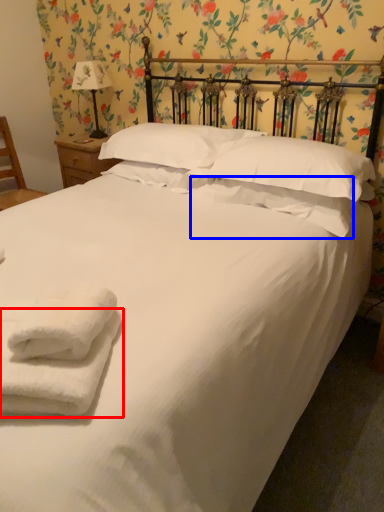
Question: Which of the following is the closest to the observer, towel (highlighted by a red box) or pillow (highlighted by a blue box)?

Choices:
 (A) towel
 (B) pillow

Answer: (A)